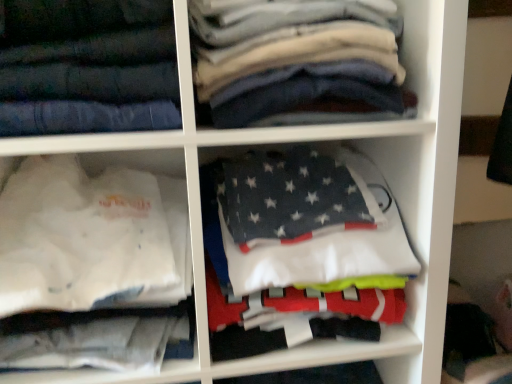
What is the approximate width of dark gray cotton shirts at upper center?

It is 12.61 inches.

I want to click on white fabric shirt at lower left, marked as the first cabinet in a left-to-right arrangement, so click(x=93, y=234).

Is dark blue denim jeans at upper left behind white fabric shirt at lower left, marked as the first cabinet in a left-to-right arrangement?

No, dark blue denim jeans at upper left is in front of white fabric shirt at lower left, marked as the first cabinet in a left-to-right arrangement.

Is dark blue denim jeans at upper left touching white fabric shirt at lower left, marked as the first cabinet in a left-to-right arrangement?

No, dark blue denim jeans at upper left is not next to white fabric shirt at lower left, marked as the first cabinet in a left-to-right arrangement.

How many degrees apart are the facing directions of dark blue denim jeans at upper left and white fabric shirt at lower left, the 2th cabinet from the right?

The angle between the facing direction of dark blue denim jeans at upper left and the facing direction of white fabric shirt at lower left, the 2th cabinet from the right, is 0.000168 degrees.

At what (x,y) coordinates should I click in order to perform the action: click on trousers above the white fabric shirt at lower left, the 2th cabinet from the right (from the image's perspective). Please return your answer as a coordinate pair (x, y). Looking at the image, I should click on (87, 66).

Is dark gray cotton shirts at upper center to the left of dark blue denim jeans at upper left from the viewer's perspective?

No.

Considering the sizes of dark gray cotton shirts at upper center and dark blue denim jeans at upper left in the image, is dark gray cotton shirts at upper center wider or thinner than dark blue denim jeans at upper left?

Considering their sizes, dark gray cotton shirts at upper center looks broader than dark blue denim jeans at upper left.

Which of these two, dark gray cotton shirts at upper center or dark blue denim jeans at upper left, stands taller?

With more height is dark blue denim jeans at upper left.

In the scene shown: Considering the relative sizes of dark gray fleece blanket at center, the first cabinet positioned from the right, and dark gray cotton shirts at upper center in the image provided, is dark gray fleece blanket at center, the first cabinet positioned from the right, thinner than dark gray cotton shirts at upper center?

Correct, the width of dark gray fleece blanket at center, the first cabinet positioned from the right, is less than that of dark gray cotton shirts at upper center.

Is dark gray fleece blanket at center, the 2th cabinet in the left-to-right sequence, far away from dark gray cotton shirts at upper center?

dark gray fleece blanket at center, the 2th cabinet in the left-to-right sequence, is near dark gray cotton shirts at upper center, not far away.

What's the angular difference between dark gray fleece blanket at center, the first cabinet positioned from the right, and dark gray cotton shirts at upper center's facing directions?

The angular difference between dark gray fleece blanket at center, the first cabinet positioned from the right, and dark gray cotton shirts at upper center is 0.000204 degrees.

From the image's perspective, which one is positioned lower, dark gray fleece blanket at center, the 2th cabinet in the left-to-right sequence, or dark gray cotton shirts at upper center?

From the image's view, dark gray fleece blanket at center, the 2th cabinet in the left-to-right sequence, is below.

Can we say dark gray cotton shirts at upper center lies outside dark gray fleece blanket at center, the 2th cabinet in the left-to-right sequence?

Yes, dark gray cotton shirts at upper center is not within dark gray fleece blanket at center, the 2th cabinet in the left-to-right sequence.

Does dark gray cotton shirts at upper center have a lesser height compared to dark gray fleece blanket at center, the 2th cabinet in the left-to-right sequence?

Indeed, dark gray cotton shirts at upper center has a lesser height compared to dark gray fleece blanket at center, the 2th cabinet in the left-to-right sequence.

You are a GUI agent. You are given a task and a screenshot of the screen. Output one action in this format:
    pyautogui.click(x=<x>, y=<y>)
    Task: Click on the clothing above the dark gray fleece blanket at center, the 2th cabinet in the left-to-right sequence (from the image's perspective)
    The image size is (512, 384).
    Given the screenshot: What is the action you would take?
    pyautogui.click(x=298, y=61)

Based on the photo, is dark gray cotton shirts at upper center wider or thinner than dark gray fleece blanket at center, the 2th cabinet in the left-to-right sequence?

dark gray cotton shirts at upper center is wider than dark gray fleece blanket at center, the 2th cabinet in the left-to-right sequence.

Looking at their sizes, would you say dark blue denim jeans at upper left is wider or thinner than dark gray cotton shirts at upper center?

Clearly, dark blue denim jeans at upper left has less width compared to dark gray cotton shirts at upper center.

From a real-world perspective, is dark blue denim jeans at upper left below dark gray cotton shirts at upper center?

No, from a real-world perspective, dark blue denim jeans at upper left is not under dark gray cotton shirts at upper center.

Consider the image. Is dark blue denim jeans at upper left facing towards dark gray cotton shirts at upper center?

No.

Which of these two, white fabric shirt at lower left, marked as the first cabinet in a left-to-right arrangement, or dark gray fleece blanket at center, the first cabinet positioned from the right, is bigger?

Bigger between the two is white fabric shirt at lower left, marked as the first cabinet in a left-to-right arrangement.

Where is `cabinet in front of the dark gray fleece blanket at center, the 2th cabinet in the left-to-right sequence`? Image resolution: width=512 pixels, height=384 pixels. cabinet in front of the dark gray fleece blanket at center, the 2th cabinet in the left-to-right sequence is located at coordinates (93, 234).

From the image's perspective, is white fabric shirt at lower left, marked as the first cabinet in a left-to-right arrangement, on top of dark gray fleece blanket at center, the 2th cabinet in the left-to-right sequence?

Incorrect, from the image's perspective, white fabric shirt at lower left, marked as the first cabinet in a left-to-right arrangement, is lower than dark gray fleece blanket at center, the 2th cabinet in the left-to-right sequence.

Can you tell me how much dark gray fleece blanket at center, the first cabinet positioned from the right, and white fabric shirt at lower left, marked as the first cabinet in a left-to-right arrangement, differ in facing direction?

9.98e-05 degrees separate the facing orientations of dark gray fleece blanket at center, the first cabinet positioned from the right, and white fabric shirt at lower left, marked as the first cabinet in a left-to-right arrangement.

Is white fabric shirt at lower left, marked as the first cabinet in a left-to-right arrangement, a part of dark gray fleece blanket at center, the first cabinet positioned from the right?

No, white fabric shirt at lower left, marked as the first cabinet in a left-to-right arrangement, is located outside of dark gray fleece blanket at center, the first cabinet positioned from the right.

In the scene shown: From their relative heights in the image, would you say dark gray fleece blanket at center, the first cabinet positioned from the right, is taller or shorter than white fabric shirt at lower left, the 2th cabinet from the right?

Considering their sizes, dark gray fleece blanket at center, the first cabinet positioned from the right, has less height than white fabric shirt at lower left, the 2th cabinet from the right.

Is dark gray fleece blanket at center, the first cabinet positioned from the right, smaller than white fabric shirt at lower left, marked as the first cabinet in a left-to-right arrangement?

Yes.

This screenshot has height=384, width=512. I want to click on trousers that appears above the white fabric shirt at lower left, the 2th cabinet from the right (from the image's perspective), so click(x=87, y=66).

The image size is (512, 384). What are the coordinates of `trousers located below the dark gray cotton shirts at upper center (from the image's perspective)` in the screenshot? It's located at (x=87, y=66).

Considering their positions, is white fabric shirt at lower left, marked as the first cabinet in a left-to-right arrangement, positioned further to dark gray cotton shirts at upper center than dark blue denim jeans at upper left?

Based on the image, white fabric shirt at lower left, marked as the first cabinet in a left-to-right arrangement, appears to be further to dark gray cotton shirts at upper center.

Estimate the real-world distances between objects in this image. Which object is further from dark gray fleece blanket at center, the first cabinet positioned from the right, dark blue denim jeans at upper left or white fabric shirt at lower left, marked as the first cabinet in a left-to-right arrangement?

dark blue denim jeans at upper left lies further to dark gray fleece blanket at center, the first cabinet positioned from the right, than the other object.

When comparing their distances from white fabric shirt at lower left, the 2th cabinet from the right, does dark gray fleece blanket at center, the 2th cabinet in the left-to-right sequence, or dark gray cotton shirts at upper center seem further?

The object further to white fabric shirt at lower left, the 2th cabinet from the right, is dark gray cotton shirts at upper center.

Considering their positions, is white fabric shirt at lower left, the 2th cabinet from the right, positioned closer to dark gray fleece blanket at center, the first cabinet positioned from the right, than dark blue denim jeans at upper left?

white fabric shirt at lower left, the 2th cabinet from the right, lies closer to dark gray fleece blanket at center, the first cabinet positioned from the right, than the other object.

Estimate the real-world distances between objects in this image. Which object is closer to dark blue denim jeans at upper left, dark gray fleece blanket at center, the first cabinet positioned from the right, or white fabric shirt at lower left, the 2th cabinet from the right?

white fabric shirt at lower left, the 2th cabinet from the right, is closer to dark blue denim jeans at upper left.

Based on their spatial positions, is dark gray fleece blanket at center, the 2th cabinet in the left-to-right sequence, or dark blue denim jeans at upper left further from white fabric shirt at lower left, marked as the first cabinet in a left-to-right arrangement?

The object further to white fabric shirt at lower left, marked as the first cabinet in a left-to-right arrangement, is dark blue denim jeans at upper left.

Which object lies further to the anchor point dark blue denim jeans at upper left, dark gray cotton shirts at upper center or dark gray fleece blanket at center, the first cabinet positioned from the right?

Based on the image, dark gray fleece blanket at center, the first cabinet positioned from the right, appears to be further to dark blue denim jeans at upper left.

Looking at the image, which one is located closer to white fabric shirt at lower left, the 2th cabinet from the right, dark gray cotton shirts at upper center or dark blue denim jeans at upper left?

Among the two, dark blue denim jeans at upper left is located nearer to white fabric shirt at lower left, the 2th cabinet from the right.

The height and width of the screenshot is (384, 512). What are the coordinates of `clothing between white fabric shirt at lower left, marked as the first cabinet in a left-to-right arrangement, and dark gray fleece blanket at center, the first cabinet positioned from the right, from left to right` in the screenshot? It's located at (298, 61).

Locate an element on the screen. This screenshot has height=384, width=512. clothing between dark blue denim jeans at upper left and dark gray fleece blanket at center, the 2th cabinet in the left-to-right sequence, in the horizontal direction is located at coordinates click(x=298, y=61).

Identify the location of cabinet between dark blue denim jeans at upper left and dark gray fleece blanket at center, the first cabinet positioned from the right. (93, 234).

In order to click on cabinet between dark blue denim jeans at upper left and dark gray cotton shirts at upper center in the horizontal direction in this screenshot , I will do `click(93, 234)`.